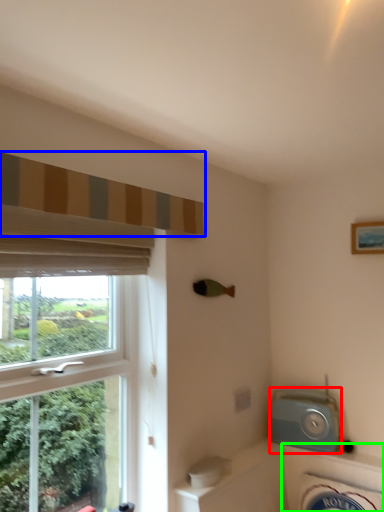
Question: Which is farther away from appliance (highlighted by a red box)? curtain (highlighted by a blue box) or bath (highlighted by a green box)?

Choices:
 (A) curtain
 (B) bath

Answer: (A)